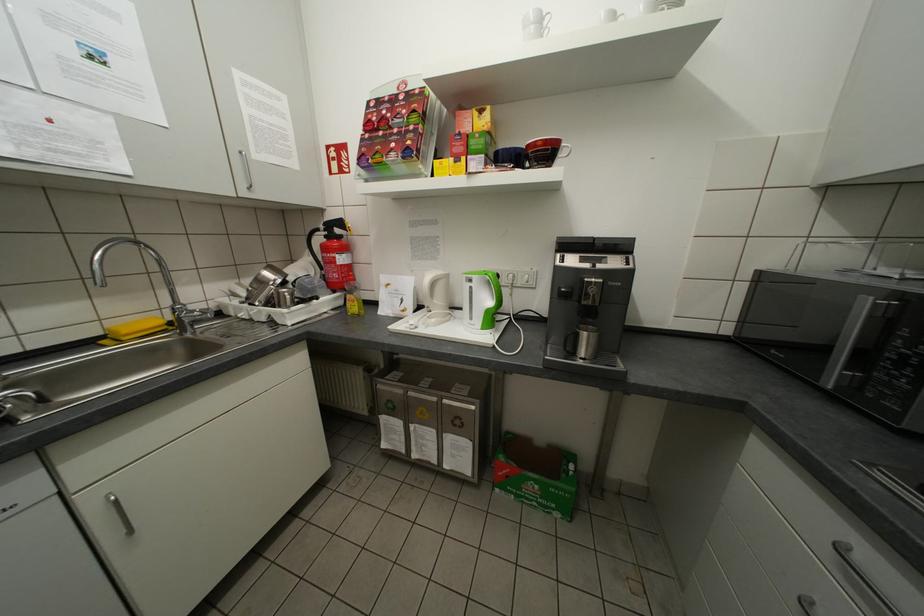
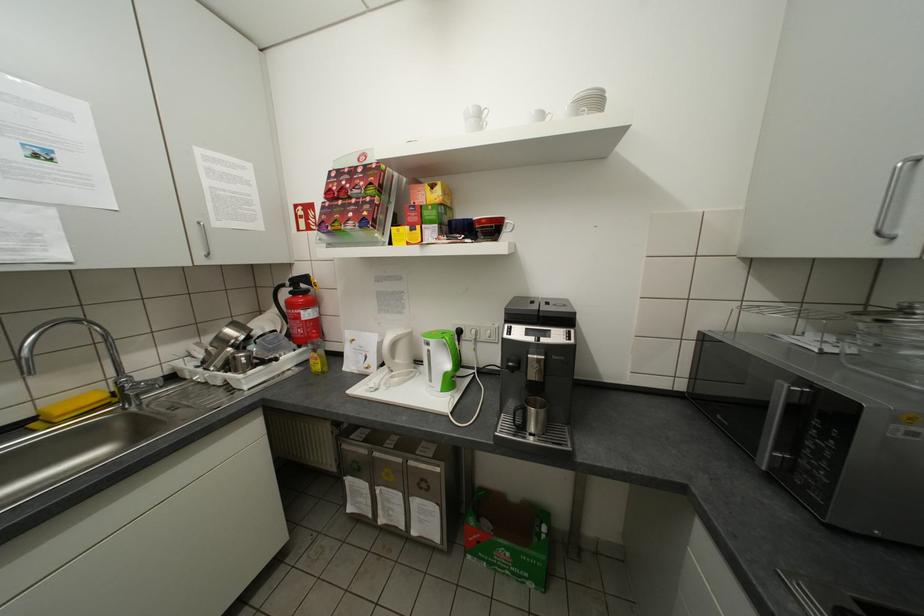
Where in the second image is the point corresponding to (x=541, y=28) from the first image?

(481, 120)